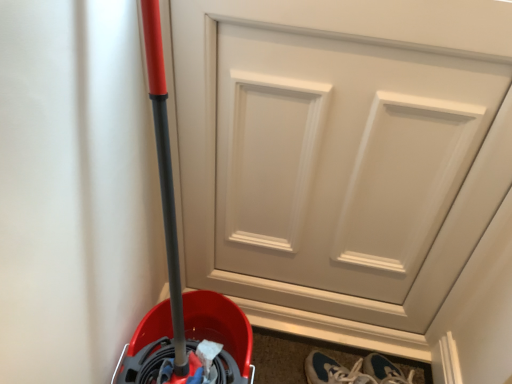
Question: Looking at their shapes, would you say blue suede sneakers at lower right is wider or thinner than white matte door at center?

Choices:
 (A) wide
 (B) thin

Answer: (A)

Question: From the image's perspective, is blue suede sneakers at lower right above or below white matte door at center?

Choices:
 (A) below
 (B) above

Answer: (A)

Question: From a real-world perspective, relative to white matte door at center, is blue suede sneakers at lower right vertically above or below?

Choices:
 (A) below
 (B) above

Answer: (A)

Question: In the image, is white matte door at center positioned in front of or behind blue suede sneakers at lower right?

Choices:
 (A) front
 (B) behind

Answer: (A)

Question: From a real-world perspective, relative to blue suede sneakers at lower right, is white matte door at center vertically above or below?

Choices:
 (A) below
 (B) above

Answer: (B)

Question: Looking at the image, does white matte door at center seem bigger or smaller compared to blue suede sneakers at lower right?

Choices:
 (A) small
 (B) big

Answer: (B)

Question: Is point (204, 173) positioned closer to the camera than point (364, 375)?

Choices:
 (A) farther
 (B) closer

Answer: (B)